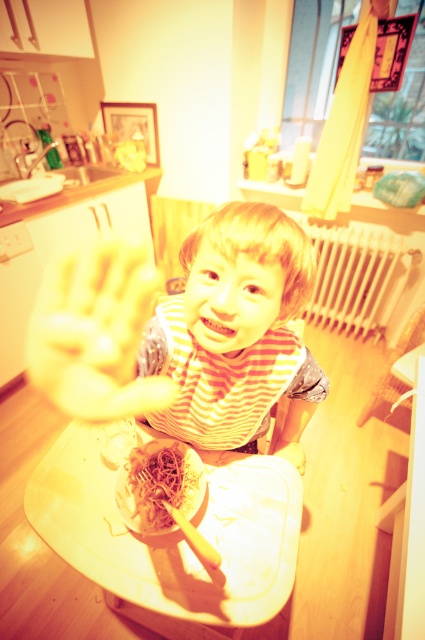
From the picture: You are a parent trying to ensure your child is safely seated in the high chair. Based on the image, is the yellow matte hand at center positioned above or below the striped fabric toddler at center?

The yellow matte hand at center is positioned above the striped fabric toddler at center because the toddler has a lesser height compared to the hand.

You are a parent trying to place a toy on the white plastic tray at lower center without it falling off. Considering the yellow matte hand at center is currently on the tray, do you think the tray is wide enough to accommodate both the toy and the hand?

The white plastic tray at lower center has a lesser width compared to yellow matte hand at center, so it is unlikely to have enough space for both the toy and the hand.